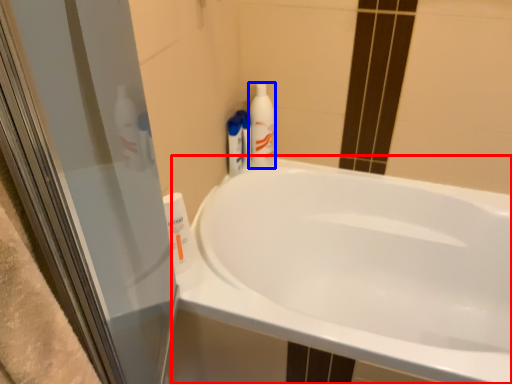
Question: Which object appears closest to the camera in this image, bathtub (highlighted by a red box) or cleaning product (highlighted by a blue box)?

Choices:
 (A) bathtub
 (B) cleaning product

Answer: (A)